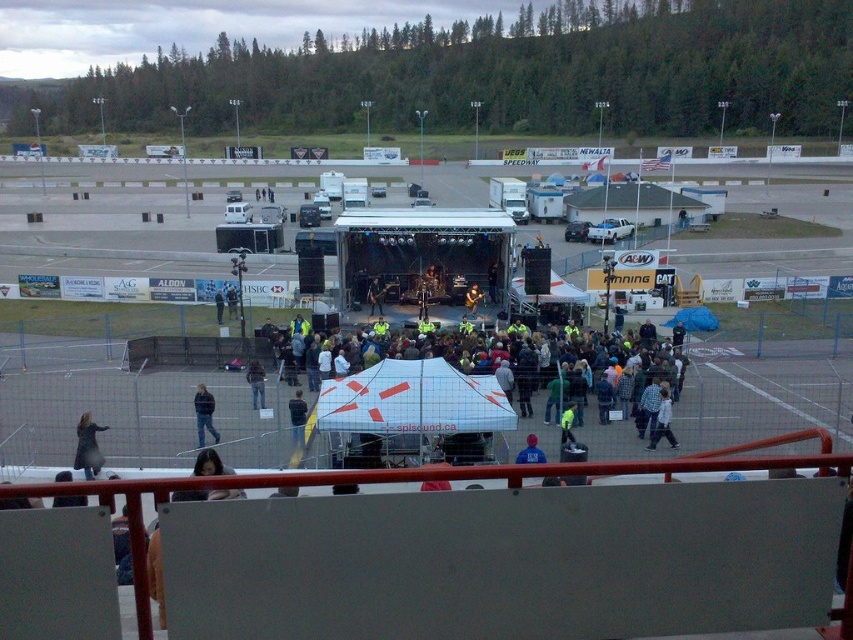
Question: Is white cotton jacket at lower center thinner than dark blue jeans at center?

Choices:
 (A) no
 (B) yes

Answer: (A)

Question: Is dark blue jacket at center wider than blue fabric at center?

Choices:
 (A) yes
 (B) no

Answer: (B)

Question: Which point is closer to the camera taking this photo?

Choices:
 (A) (84, 465)
 (B) (660, 433)
 (C) (534, 445)

Answer: (C)

Question: Which object is positioned farthest from the dark blue jeans at center?

Choices:
 (A) blue denim jeans at lower left
 (B) dark blue jacket at center

Answer: (B)

Question: Which of the following is the closest to the observer?

Choices:
 (A) (535, 438)
 (B) (262, 396)
 (C) (206, 426)
 (D) (668, 403)

Answer: (A)

Question: Can you confirm if black leather jacket at lower left is positioned to the left of blue denim jeans at lower left?

Choices:
 (A) yes
 (B) no

Answer: (A)